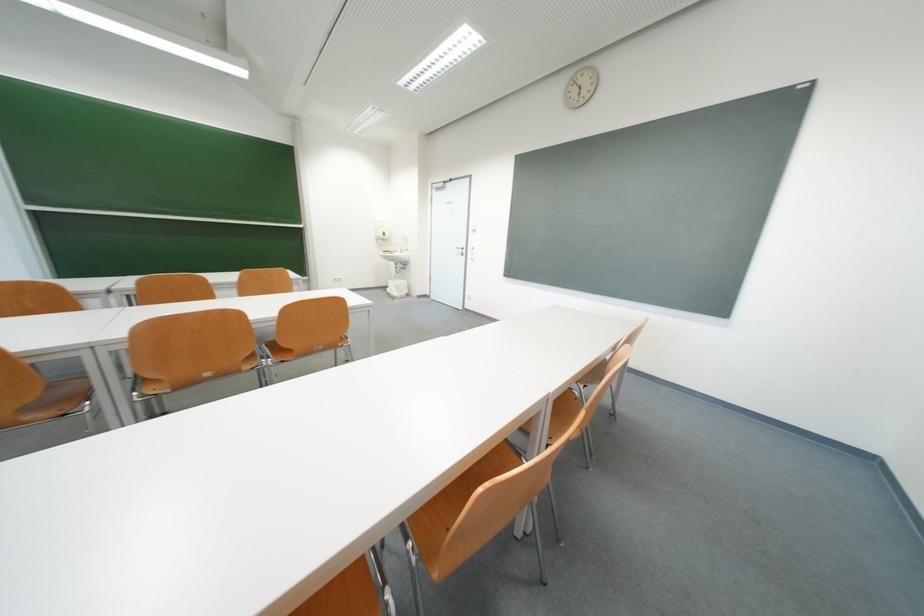
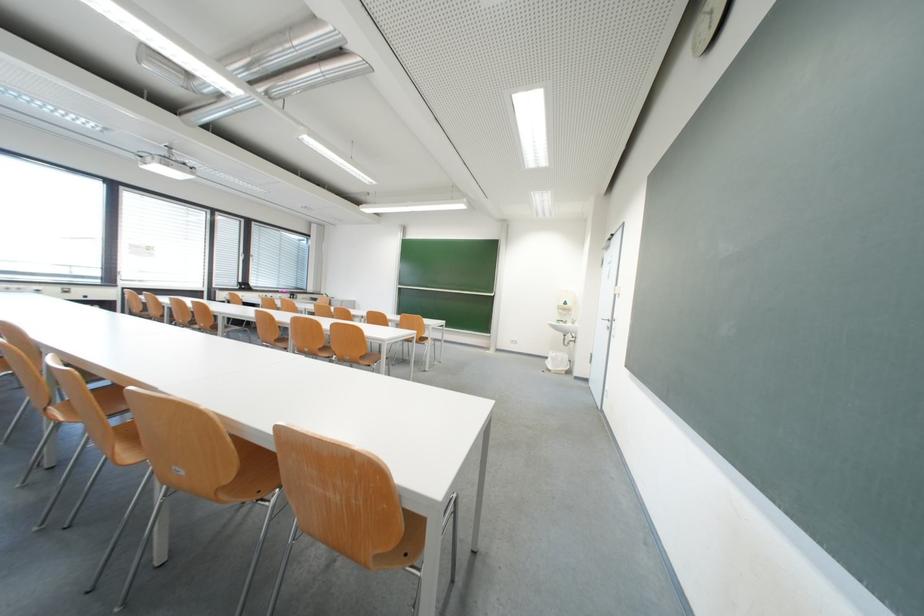
Where in the second image is the point corresponding to the point at 396,256 from the first image?

(570, 326)